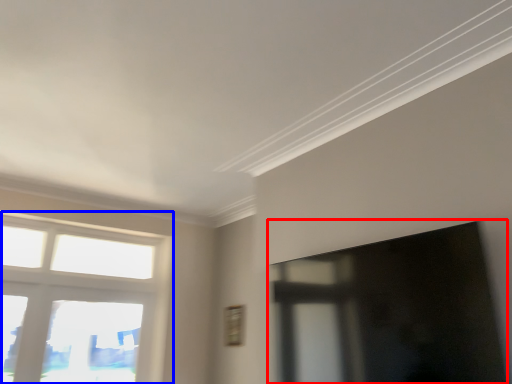
Question: Which object is closer to the camera taking this photo, window screen (highlighted by a red box) or window (highlighted by a blue box)?

Choices:
 (A) window screen
 (B) window

Answer: (A)